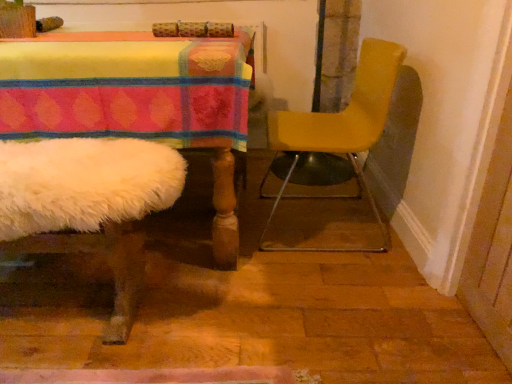
This screenshot has height=384, width=512. I want to click on vacant space in front of yellow leather chair at right, so click(326, 288).